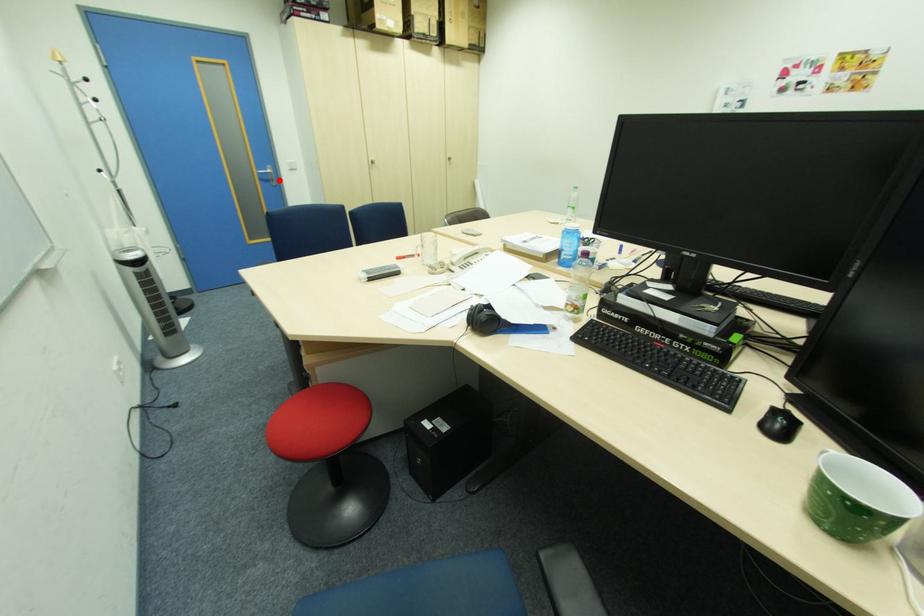
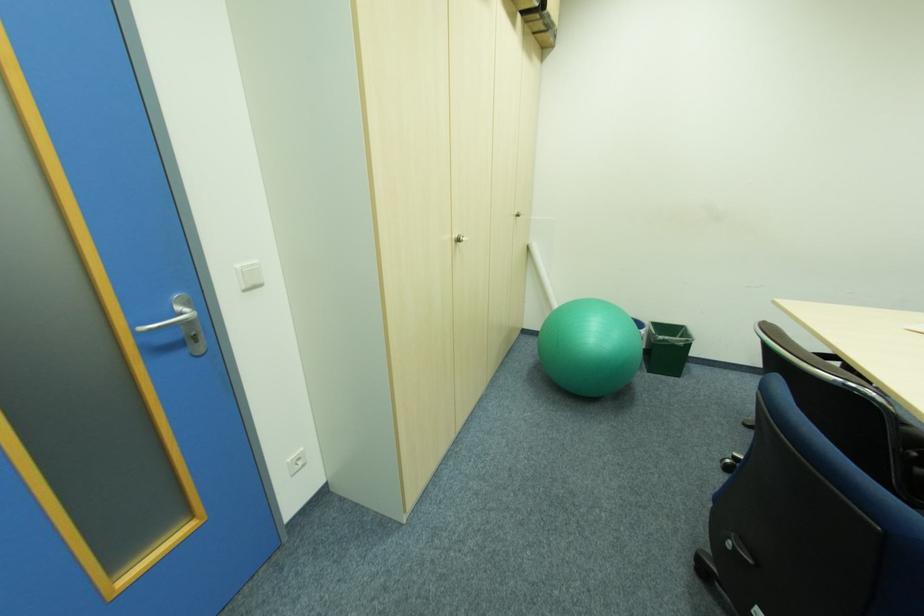
The point at the highlighted location is marked in the first image. Where is the corresponding point in the second image?

(200, 339)